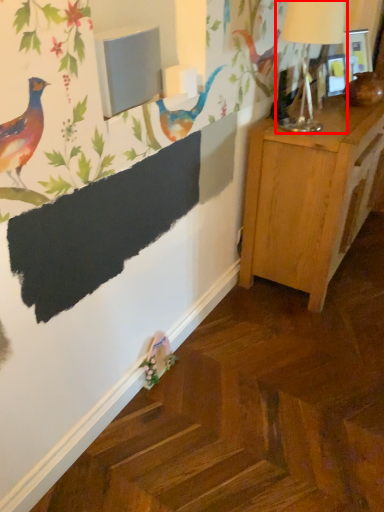
Question: From the image's perspective, where is table lamp (annotated by the red box) located in relation to nightstand in the image?

Choices:
 (A) above
 (B) below

Answer: (A)